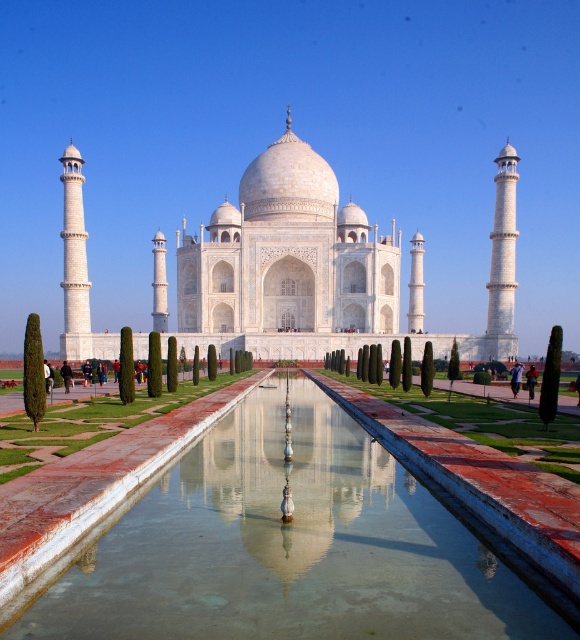
Is white marble taj mahal at center bigger than white marble water at center?

Yes.

Where is `white marble taj mahal at center`? This screenshot has width=580, height=640. white marble taj mahal at center is located at coordinates (288, 262).

Find the location of a particular element. Image resolution: width=580 pixels, height=640 pixels. white marble taj mahal at center is located at coordinates pos(288,262).

Is the position of clear glass water at center less distant than that of white marble taj mahal at center?

Yes, clear glass water at center is closer to the viewer.

Is clear glass water at center smaller than white marble taj mahal at center?

Yes.

Which is in front, point (298, 385) or point (302, 220)?

Point (298, 385)

Image resolution: width=580 pixels, height=640 pixels. Find the location of `clear glass water at center`. clear glass water at center is located at coordinates (288, 545).

Is point (251, 568) less distant than point (339, 522)?

Yes, point (251, 568) is in front of point (339, 522).

Between clear glass water at center and white marble water at center, which one has more height?

Standing taller between the two is clear glass water at center.

Who is more distant from viewer, [183,577] or [201,538]?

The point [201,538] is behind.

You are a GUI agent. You are given a task and a screenshot of the screen. Output one action in this format:
    pyautogui.click(x=<x>, y=<y>)
    Task: Click on the clear glass water at center
    
    Given the screenshot: What is the action you would take?
    pyautogui.click(x=288, y=545)